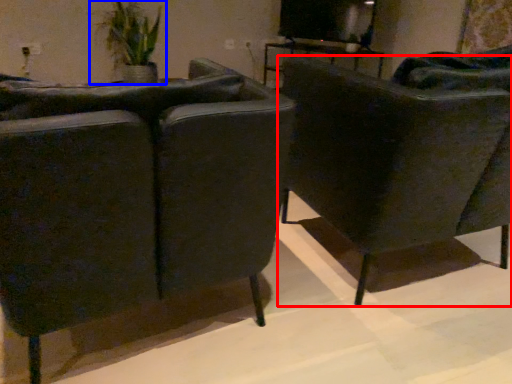
Question: Which of the following is the closest to the observer, chair (highlighted by a red box) or houseplant (highlighted by a blue box)?

Choices:
 (A) chair
 (B) houseplant

Answer: (A)